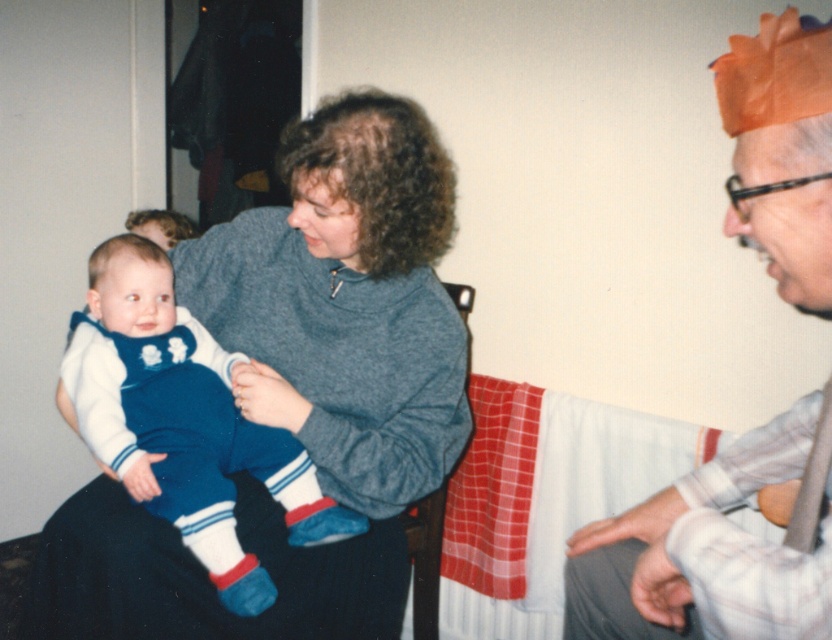
Question: Is the position of matte gray shirt at right more distant than that of velvet blue jumpsuit at center?

Choices:
 (A) no
 (B) yes

Answer: (A)

Question: Among these objects, which one is nearest to the camera?

Choices:
 (A) velvet blue jumpsuit at center
 (B) matte gray shirt at right

Answer: (B)

Question: Is the position of matte gray shirt at right less distant than that of velvet blue jumpsuit at center?

Choices:
 (A) yes
 (B) no

Answer: (A)

Question: Can you confirm if matte gray shirt at right is smaller than velvet blue jumpsuit at center?

Choices:
 (A) yes
 (B) no

Answer: (B)

Question: Which of the following is the closest to the observer?

Choices:
 (A) (176, 499)
 (B) (755, 429)

Answer: (B)

Question: Which point is closer to the camera?

Choices:
 (A) (83, 397)
 (B) (781, 422)

Answer: (B)